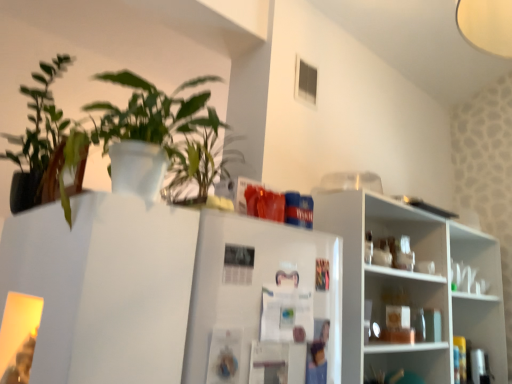
What do you see at coordinates (411, 360) in the screenshot?
I see `white glossy shelf at lower right, acting as the 1th shelf starting from the bottom` at bounding box center [411, 360].

Locate an element on the screen. This screenshot has width=512, height=384. green matte plant at upper left, the 1th houseplant when ordered from right to left is located at coordinates (142, 141).

Describe the element at coordinates (45, 147) in the screenshot. This screenshot has height=384, width=512. I see `green matte plant at upper left, marked as the 1th houseplant in a left-to-right arrangement` at that location.

In order to click on white glossy shelf at lower right, the 2th shelf viewed from the top in this screenshot , I will do `click(411, 360)`.

Considering the relative positions of white paperboard fridge at center and green matte plant at upper left, marked as the 2th houseplant in a right-to-left arrangement, in the image provided, is white paperboard fridge at center to the right of green matte plant at upper left, marked as the 2th houseplant in a right-to-left arrangement, from the viewer's perspective?

Correct, you'll find white paperboard fridge at center to the right of green matte plant at upper left, marked as the 2th houseplant in a right-to-left arrangement.

Is white paperboard fridge at center smaller than green matte plant at upper left, marked as the 1th houseplant in a left-to-right arrangement?

Correct, white paperboard fridge at center occupies less space than green matte plant at upper left, marked as the 1th houseplant in a left-to-right arrangement.

From a real-world perspective, between white paperboard fridge at center and green matte plant at upper left, marked as the 1th houseplant in a left-to-right arrangement, who is vertically higher?

green matte plant at upper left, marked as the 1th houseplant in a left-to-right arrangement, from a real-world perspective.

How many degrees apart are the facing directions of white glossy shelves at right, the first shelf positioned from the top, and white glossy shelf at lower right, acting as the 1th shelf starting from the bottom?

The facing directions of white glossy shelves at right, the first shelf positioned from the top, and white glossy shelf at lower right, acting as the 1th shelf starting from the bottom, are 0.448 degrees apart.

Would you say white glossy shelves at right, the first shelf positioned from the top, is outside white glossy shelf at lower right, acting as the 1th shelf starting from the bottom?

white glossy shelves at right, the first shelf positioned from the top, lies outside white glossy shelf at lower right, acting as the 1th shelf starting from the bottom,'s area.

From the image's perspective, is white glossy shelves at right, the second shelf in the bottom-to-top sequence, located above white glossy shelf at lower right, the 2th shelf viewed from the top?

Correct, white glossy shelves at right, the second shelf in the bottom-to-top sequence, appears higher than white glossy shelf at lower right, the 2th shelf viewed from the top, in the image.

Is there a large distance between white glossy shelves at right, the first shelf positioned from the top, and white glossy shelf at lower right, the 2th shelf viewed from the top?

white glossy shelves at right, the first shelf positioned from the top, is near white glossy shelf at lower right, the 2th shelf viewed from the top, not far away.

Between white paperboard fridge at center and white glossy shelf at lower right, acting as the 1th shelf starting from the bottom, which one has more height?

white paperboard fridge at center.

From a real-world perspective, is white paperboard fridge at center above or below white glossy shelf at lower right, the 2th shelf viewed from the top?

white paperboard fridge at center is situated higher than white glossy shelf at lower right, the 2th shelf viewed from the top, in the real world.

Are white paperboard fridge at center and white glossy shelf at lower right, the 2th shelf viewed from the top, beside each other?

No, white paperboard fridge at center is not touching white glossy shelf at lower right, the 2th shelf viewed from the top.

Considering the relative sizes of white paperboard fridge at center and white glossy shelf at lower right, the 2th shelf viewed from the top, in the image provided, is white paperboard fridge at center smaller than white glossy shelf at lower right, the 2th shelf viewed from the top,?

No, white paperboard fridge at center is not smaller than white glossy shelf at lower right, the 2th shelf viewed from the top.

Considering the relative positions of white glossy shelves at right, the first shelf positioned from the top, and white paperboard fridge at center in the image provided, is white glossy shelves at right, the first shelf positioned from the top, to the left or to the right of white paperboard fridge at center?

From the image, it's evident that white glossy shelves at right, the first shelf positioned from the top, is to the right of white paperboard fridge at center.

Based on the photo, is white glossy shelves at right, the second shelf in the bottom-to-top sequence, facing towards white paperboard fridge at center?

No.

From the image's perspective, which one is positioned higher, white glossy shelves at right, the first shelf positioned from the top, or white paperboard fridge at center?

white paperboard fridge at center.

Are white glossy shelves at right, the second shelf in the bottom-to-top sequence, and white paperboard fridge at center far apart?

No, white glossy shelves at right, the second shelf in the bottom-to-top sequence, is not far away from white paperboard fridge at center.

Is white paperboard fridge at center oriented towards green matte plant at upper left, marked as the 2th houseplant in a left-to-right arrangement?

No.

Is white paperboard fridge at center surrounding green matte plant at upper left, marked as the 2th houseplant in a left-to-right arrangement?

No, green matte plant at upper left, marked as the 2th houseplant in a left-to-right arrangement, is not inside white paperboard fridge at center.

Is white paperboard fridge at center next to green matte plant at upper left, marked as the 2th houseplant in a left-to-right arrangement, and touching it?

There is a gap between white paperboard fridge at center and green matte plant at upper left, marked as the 2th houseplant in a left-to-right arrangement.

How many degrees apart are the facing directions of green matte plant at upper left, the 1th houseplant when ordered from right to left, and green matte plant at upper left, marked as the 1th houseplant in a left-to-right arrangement?

The angle between the facing direction of green matte plant at upper left, the 1th houseplant when ordered from right to left, and the facing direction of green matte plant at upper left, marked as the 1th houseplant in a left-to-right arrangement, is 0.000943 degrees.

Is green matte plant at upper left, marked as the 2th houseplant in a left-to-right arrangement, outside of green matte plant at upper left, marked as the 2th houseplant in a right-to-left arrangement?

Indeed, green matte plant at upper left, marked as the 2th houseplant in a left-to-right arrangement, is completely outside green matte plant at upper left, marked as the 2th houseplant in a right-to-left arrangement.

Is green matte plant at upper left, marked as the 2th houseplant in a left-to-right arrangement, touching green matte plant at upper left, marked as the 1th houseplant in a left-to-right arrangement?

They are not placed beside each other.

Is green matte plant at upper left, the 1th houseplant when ordered from right to left, wider than green matte plant at upper left, marked as the 2th houseplant in a right-to-left arrangement?

In fact, green matte plant at upper left, the 1th houseplant when ordered from right to left, might be narrower than green matte plant at upper left, marked as the 2th houseplant in a right-to-left arrangement.

Who is smaller, green matte plant at upper left, marked as the 2th houseplant in a left-to-right arrangement, or white glossy shelf at lower right, acting as the 1th shelf starting from the bottom?

Smaller between the two is white glossy shelf at lower right, acting as the 1th shelf starting from the bottom.

Considering the sizes of objects green matte plant at upper left, the 1th houseplant when ordered from right to left, and white glossy shelf at lower right, the 2th shelf viewed from the top, in the image provided, who is shorter, green matte plant at upper left, the 1th houseplant when ordered from right to left, or white glossy shelf at lower right, the 2th shelf viewed from the top,?

white glossy shelf at lower right, the 2th shelf viewed from the top, is shorter.

What's the angular difference between green matte plant at upper left, the 1th houseplant when ordered from right to left, and white glossy shelf at lower right, the 2th shelf viewed from the top,'s facing directions?

178 degrees.

Would you say green matte plant at upper left, marked as the 2th houseplant in a left-to-right arrangement, is outside white glossy shelf at lower right, acting as the 1th shelf starting from the bottom?

Yes, green matte plant at upper left, marked as the 2th houseplant in a left-to-right arrangement, is located beyond the bounds of white glossy shelf at lower right, acting as the 1th shelf starting from the bottom.

At what (x,y) coordinates should I click in order to perform the action: click on houseplant that is the 2nd one when counting leftward from the white paperboard fridge at center. Please return your answer as a coordinate pair (x, y). Looking at the image, I should click on (45, 147).

Where is `shelf that is above the white glossy shelf at lower right, the 2th shelf viewed from the top (from a real-world perspective)`? This screenshot has height=384, width=512. shelf that is above the white glossy shelf at lower right, the 2th shelf viewed from the top (from a real-world perspective) is located at coordinates (412, 285).

Looking at the image, which one is located closer to green matte plant at upper left, the 1th houseplant when ordered from right to left, white paperboard fridge at center or green matte plant at upper left, marked as the 1th houseplant in a left-to-right arrangement?

Based on the image, green matte plant at upper left, marked as the 1th houseplant in a left-to-right arrangement, appears to be nearer to green matte plant at upper left, the 1th houseplant when ordered from right to left.

When comparing their distances from green matte plant at upper left, marked as the 2th houseplant in a left-to-right arrangement, does white glossy shelf at lower right, acting as the 1th shelf starting from the bottom, or green matte plant at upper left, marked as the 1th houseplant in a left-to-right arrangement, seem closer?

Based on the image, green matte plant at upper left, marked as the 1th houseplant in a left-to-right arrangement, appears to be nearer to green matte plant at upper left, marked as the 2th houseplant in a left-to-right arrangement.

Which object lies nearer to the anchor point green matte plant at upper left, marked as the 2th houseplant in a left-to-right arrangement, green matte plant at upper left, marked as the 2th houseplant in a right-to-left arrangement, or white paperboard fridge at center?

green matte plant at upper left, marked as the 2th houseplant in a right-to-left arrangement, is closer to green matte plant at upper left, marked as the 2th houseplant in a left-to-right arrangement.

From the picture: From the image, which object appears to be farther from white glossy shelves at right, the first shelf positioned from the top, green matte plant at upper left, marked as the 2th houseplant in a left-to-right arrangement, or white glossy shelf at lower right, acting as the 1th shelf starting from the bottom?

The object further to white glossy shelves at right, the first shelf positioned from the top, is green matte plant at upper left, marked as the 2th houseplant in a left-to-right arrangement.

Based on their spatial positions, is white glossy shelves at right, the second shelf in the bottom-to-top sequence, or green matte plant at upper left, the 1th houseplant when ordered from right to left, further from white paperboard fridge at center?

The object further to white paperboard fridge at center is white glossy shelves at right, the second shelf in the bottom-to-top sequence.

Looking at the image, which one is located closer to white paperboard fridge at center, green matte plant at upper left, marked as the 2th houseplant in a right-to-left arrangement, or white glossy shelf at lower right, acting as the 1th shelf starting from the bottom?

Based on the image, green matte plant at upper left, marked as the 2th houseplant in a right-to-left arrangement, appears to be nearer to white paperboard fridge at center.

Which object lies nearer to the anchor point white paperboard fridge at center, green matte plant at upper left, the 1th houseplant when ordered from right to left, or white glossy shelf at lower right, the 2th shelf viewed from the top?

The object closer to white paperboard fridge at center is green matte plant at upper left, the 1th houseplant when ordered from right to left.

Looking at the image, which one is located further to green matte plant at upper left, marked as the 1th houseplant in a left-to-right arrangement, green matte plant at upper left, marked as the 2th houseplant in a left-to-right arrangement, or white glossy shelf at lower right, the 2th shelf viewed from the top?

Among the two, white glossy shelf at lower right, the 2th shelf viewed from the top, is located further to green matte plant at upper left, marked as the 1th houseplant in a left-to-right arrangement.

This screenshot has height=384, width=512. What are the coordinates of `shelf located between green matte plant at upper left, marked as the 2th houseplant in a left-to-right arrangement, and white glossy shelf at lower right, acting as the 1th shelf starting from the bottom, in the depth direction` in the screenshot? It's located at (412, 285).

Locate an element on the screen. The image size is (512, 384). fridge between green matte plant at upper left, marked as the 2th houseplant in a left-to-right arrangement, and white glossy shelf at lower right, the 2th shelf viewed from the top, in the front-back direction is located at coordinates (263, 303).

This screenshot has height=384, width=512. In order to click on fridge between green matte plant at upper left, marked as the 2th houseplant in a right-to-left arrangement, and white glossy shelves at right, the second shelf in the bottom-to-top sequence, from left to right in this screenshot , I will do `click(263, 303)`.

Where is `shelf between white paperboard fridge at center and white glossy shelf at lower right, acting as the 1th shelf starting from the bottom, in the front-back direction`? shelf between white paperboard fridge at center and white glossy shelf at lower right, acting as the 1th shelf starting from the bottom, in the front-back direction is located at coordinates (412, 285).